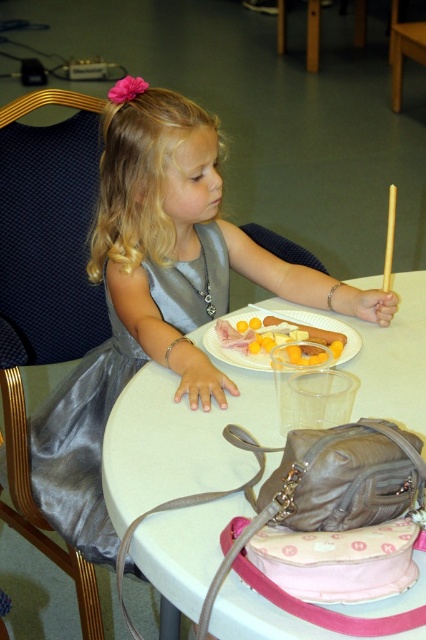
Question: Estimate the real-world distances between objects in this image. Which object is farther from the satin dress at center?

Choices:
 (A) yellow cheese at center
 (B) silky silver dress at center
 (C) white plastic table at center

Answer: (C)

Question: In this image, where is silky silver dress at center located relative to satin dress at center?

Choices:
 (A) below
 (B) above

Answer: (B)

Question: Estimate the real-world distances between objects in this image. Which object is farther from the satin dress at center?

Choices:
 (A) silky silver dress at center
 (B) white plastic table at center

Answer: (B)

Question: Is silky silver dress at center below white plastic table at center?

Choices:
 (A) yes
 (B) no

Answer: (B)

Question: Which object is the closest to the silky silver dress at center?

Choices:
 (A) satin dress at center
 (B) white plastic table at center

Answer: (A)

Question: Is white plastic table at center positioned behind yellow cheese at center?

Choices:
 (A) no
 (B) yes

Answer: (A)